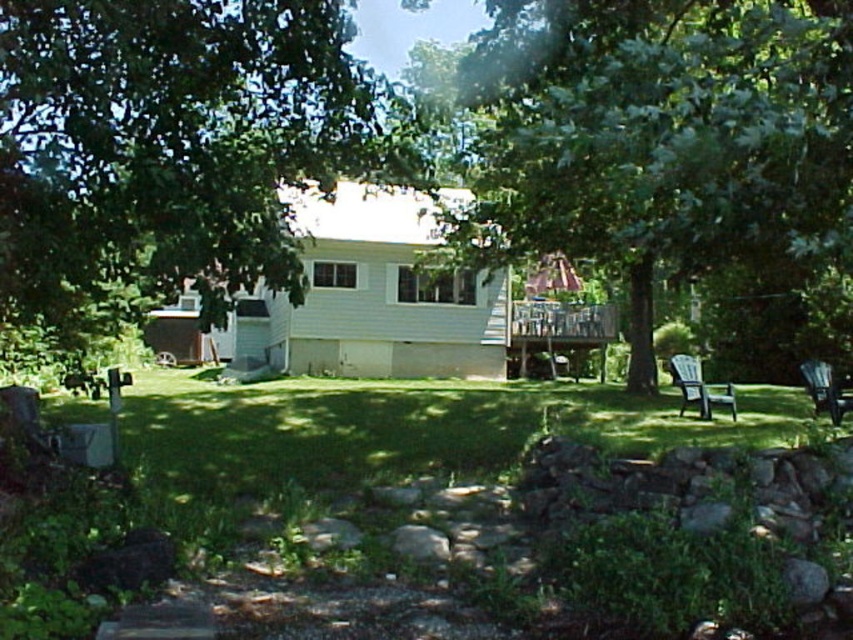
Who is taller, green leafy tree at center or green leafy tree at upper left?

green leafy tree at center

Does green leafy tree at center lie in front of green leafy tree at upper left?

Yes, green leafy tree at center is in front of green leafy tree at upper left.

At what (x,y) coordinates should I click in order to perform the action: click on green leafy tree at center. Please return your answer as a coordinate pair (x, y). The height and width of the screenshot is (640, 853). Looking at the image, I should click on (675, 157).

Image resolution: width=853 pixels, height=640 pixels. I want to click on green leafy tree at center, so click(675, 157).

Who is lower down, green plastic chair at right or black plastic chair at lower right?

green plastic chair at right is below.

What do you see at coordinates (699, 387) in the screenshot?
I see `green plastic chair at right` at bounding box center [699, 387].

This screenshot has width=853, height=640. What do you see at coordinates (699, 387) in the screenshot? I see `green plastic chair at right` at bounding box center [699, 387].

Locate an element on the screen. green plastic chair at right is located at coordinates (699, 387).

Between green grass at center and green plastic chair at right, which one has less height?

green grass at center

Is point (370, 429) farther from viewer compared to point (683, 388)?

No, (370, 429) is closer to viewer.

Who is more distant from viewer, (589, 428) or (686, 406)?

Positioned behind is point (686, 406).

Where is `green grass at center`? The width and height of the screenshot is (853, 640). green grass at center is located at coordinates (407, 426).